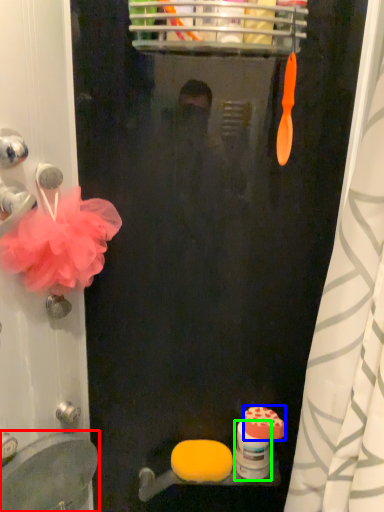
Question: Estimate the real-world distances between objects in this image. Which object is closer to sink (highlighted by a red box), soap (highlighted by a blue box) or toilet paper (highlighted by a green box)?

Choices:
 (A) soap
 (B) toilet paper

Answer: (B)